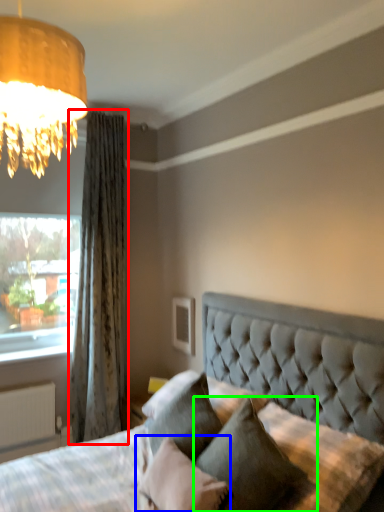
Question: Considering the real-world distances, which object is farthest from curtain (highlighted by a red box)? pillow (highlighted by a blue box) or pillow (highlighted by a green box)?

Choices:
 (A) pillow
 (B) pillow

Answer: (B)